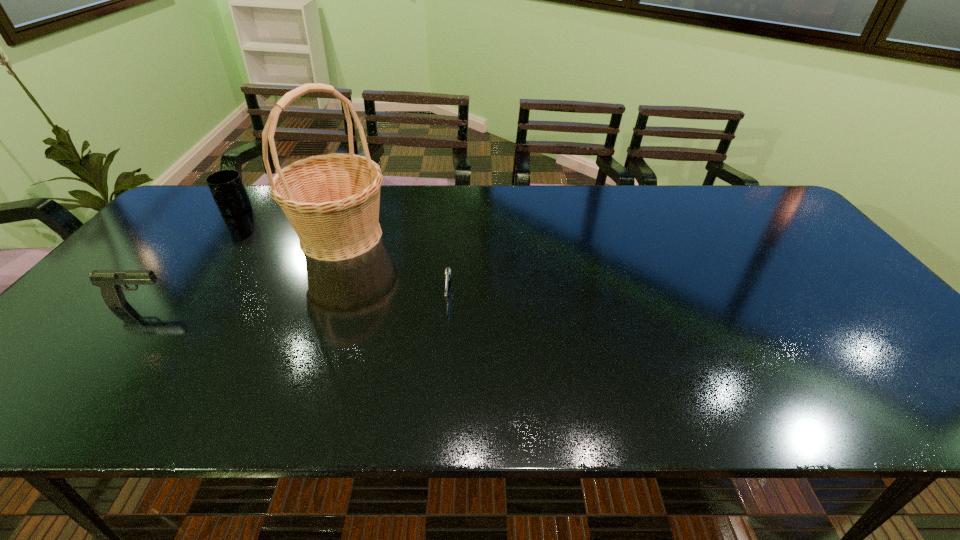
Image resolution: width=960 pixels, height=540 pixels. I want to click on basket present at the far edge, so click(332, 201).

Identify the location of mug situated at the far edge. The image size is (960, 540). (226, 186).

Image resolution: width=960 pixels, height=540 pixels. I want to click on mug present at the left edge, so click(226, 186).

Find the location of a particular element. The height and width of the screenshot is (540, 960). pistol that is positioned at the left edge is located at coordinates (110, 281).

You are a GUI agent. You are given a task and a screenshot of the screen. Output one action in this format:
    pyautogui.click(x=<x>, y=<y>)
    Task: Click on the object that is at the far left corner
    The width and height of the screenshot is (960, 540).
    Given the screenshot: What is the action you would take?
    pyautogui.click(x=226, y=186)

Where is `vacant space at the far edge of the desktop`? The height and width of the screenshot is (540, 960). vacant space at the far edge of the desktop is located at coordinates (555, 197).

Where is `vacant space at the near edge of the desktop`? vacant space at the near edge of the desktop is located at coordinates (470, 396).

In the image, there is a desktop. Where is `vacant space at the left edge`? Image resolution: width=960 pixels, height=540 pixels. vacant space at the left edge is located at coordinates (149, 265).

The image size is (960, 540). Identify the location of vacant space at the right edge of the desktop. (804, 243).

Find the location of a particular element. vacant space in between the taller pistol and the mug is located at coordinates (187, 258).